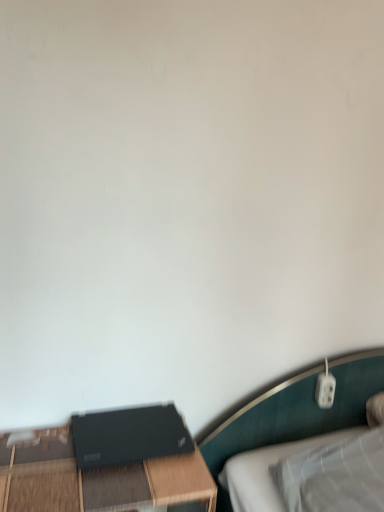
Question: From their relative heights in the image, would you say black matte laptop at lower left is taller or shorter than black matte table at lower left?

Choices:
 (A) tall
 (B) short

Answer: (B)

Question: Relative to black matte table at lower left, is black matte laptop at lower left in front or behind?

Choices:
 (A) front
 (B) behind

Answer: (B)

Question: From the image's perspective, relative to black matte table at lower left, is black matte laptop at lower left above or below?

Choices:
 (A) above
 (B) below

Answer: (A)

Question: Is black matte table at lower left bigger or smaller than black matte laptop at lower left?

Choices:
 (A) big
 (B) small

Answer: (A)

Question: In the image, is black matte table at lower left on the left side or the right side of black matte laptop at lower left?

Choices:
 (A) right
 (B) left

Answer: (B)

Question: Is point (x=34, y=462) positioned closer to the camera than point (x=185, y=441)?

Choices:
 (A) farther
 (B) closer

Answer: (B)

Question: Relative to black matte laptop at lower left, is black matte table at lower left in front or behind?

Choices:
 (A) front
 (B) behind

Answer: (A)